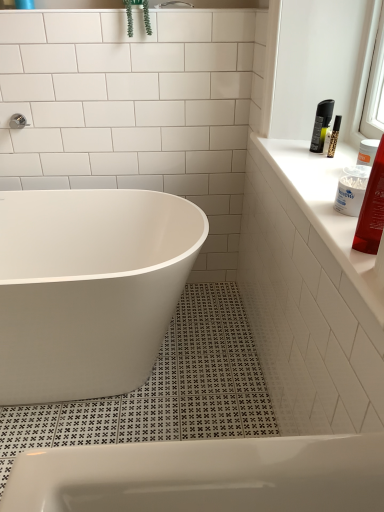
Question: From a real-world perspective, is shiny red plastic tube at upper right above or below white glossy bathtub at center?

Choices:
 (A) above
 (B) below

Answer: (A)

Question: From the image's perspective, is shiny red plastic tube at upper right positioned above or below white glossy bathtub at center?

Choices:
 (A) above
 (B) below

Answer: (A)

Question: Considering the real-world distances, which object is closest to the white glossy countertop at upper right?

Choices:
 (A) white glossy bathtub at center
 (B) shiny red plastic tube at upper right
 (C) white plastic cotton swab container at upper right
 (D) green leafy plant at upper center

Answer: (C)

Question: Estimate the real-world distances between objects in this image. Which object is closer to the shiny red plastic tube at upper right?

Choices:
 (A) white glossy bathtub at center
 (B) white glossy countertop at upper right
 (C) green leafy plant at upper center
 (D) white plastic cotton swab container at upper right

Answer: (D)